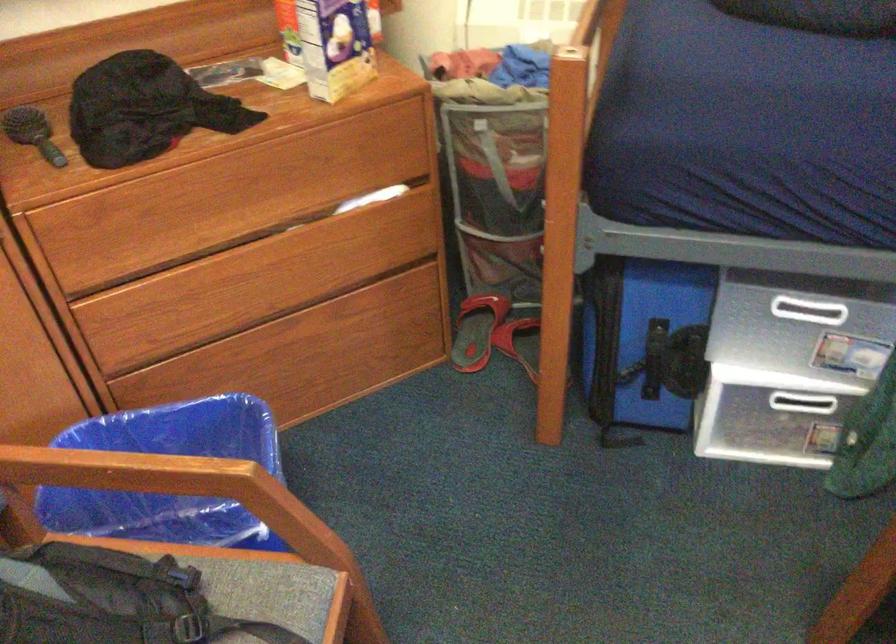
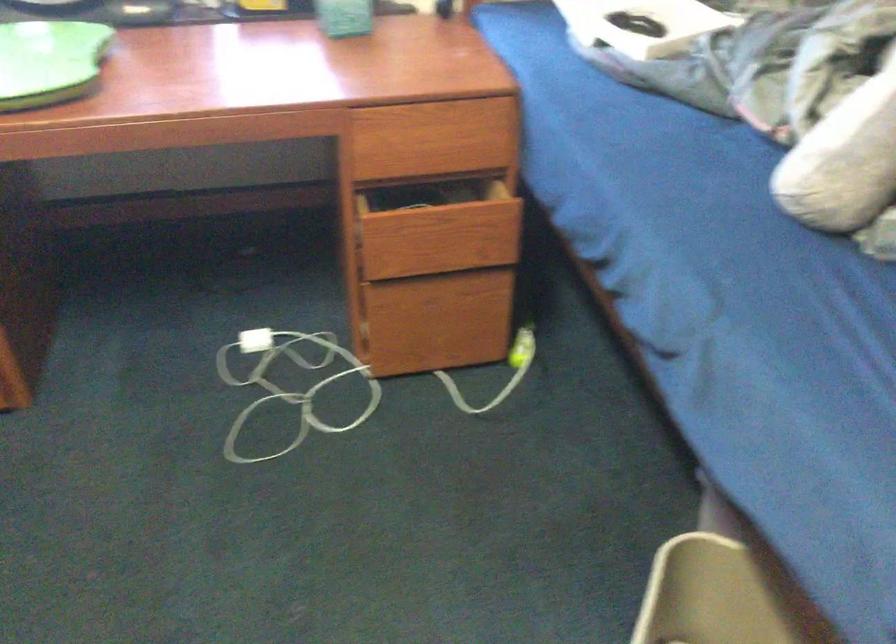
In the scene shown: Based on the continuous images, in which direction is the camera rotating?

The camera's rotation is toward right-down.